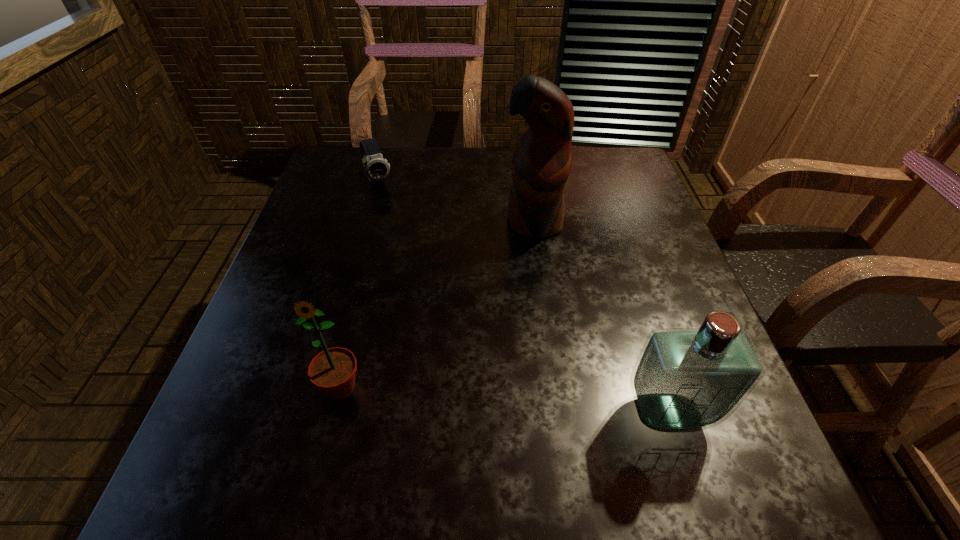
Find the location of a particular element. The width and height of the screenshot is (960, 540). sunflower is located at coordinates (333, 370).

At what (x,y) coordinates should I click in order to perform the action: click on the rightmost object. Please return your answer as a coordinate pair (x, y). Looking at the image, I should click on (685, 379).

You are a GUI agent. You are given a task and a screenshot of the screen. Output one action in this format:
    pyautogui.click(x=<x>, y=<y>)
    Task: Click on the farthest object
    
    Given the screenshot: What is the action you would take?
    [376, 168]

I want to click on the shortest object, so click(376, 168).

Where is `parrot`? This screenshot has width=960, height=540. parrot is located at coordinates (541, 162).

Where is `the third nearest object`? This screenshot has height=540, width=960. the third nearest object is located at coordinates (541, 162).

Locate an element on the screen. This screenshot has height=540, width=960. vacant position located 0.340m on the face of the watch is located at coordinates (425, 272).

Locate an element on the screen. The image size is (960, 540). vacant space located on the face of the watch is located at coordinates (419, 261).

Find the location of a particular element. The height and width of the screenshot is (540, 960). free space located 0.130m on the face of the watch is located at coordinates (396, 219).

You are a GUI agent. You are given a task and a screenshot of the screen. Output one action in this format:
    pyautogui.click(x=<x>, y=<y>)
    Task: Click on the free spot located on the face of the tallest object
    
    Given the screenshot: What is the action you would take?
    pyautogui.click(x=503, y=321)